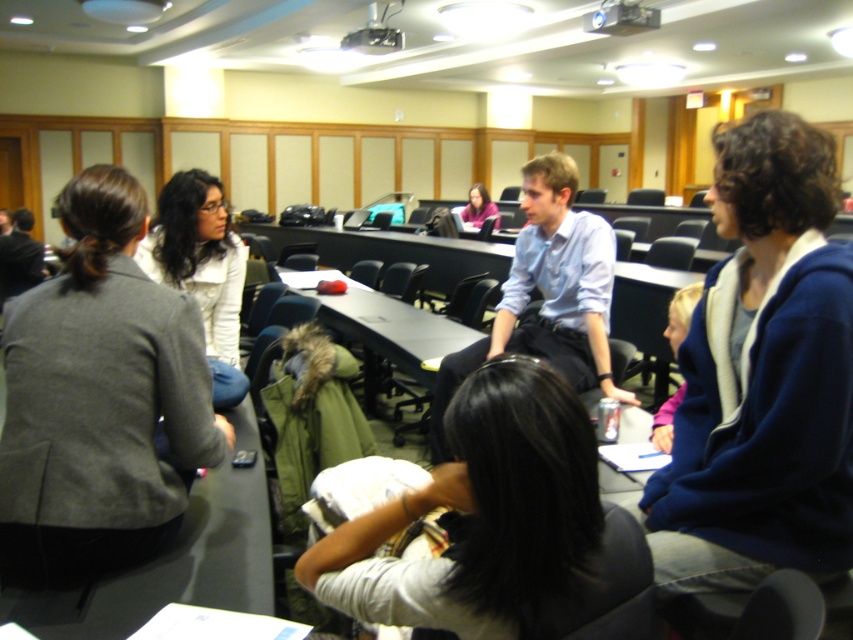
Who is lower down, blue fleece jacket at right or pink fleece sweater at center?

blue fleece jacket at right is below.

What are the coordinates of `blue fleece jacket at right` in the screenshot? It's located at (762, 376).

What do you see at coordinates (386, 330) in the screenshot? The height and width of the screenshot is (640, 853). I see `matte black table at center` at bounding box center [386, 330].

Looking at this image, can you confirm if matte black table at center is shorter than gray wool jacket at left?

Indeed, matte black table at center has a lesser height compared to gray wool jacket at left.

Measure the distance between point (x=469, y=333) and camera.

They are 11.70 feet apart.

Locate an element on the screen. This screenshot has height=640, width=853. matte black table at center is located at coordinates (386, 330).

Is light blue shirt at center further to the viewer compared to gray wool jacket at left?

No, light blue shirt at center is closer to the viewer.

Is point (489, 337) in front of point (12, 234)?

Yes, point (489, 337) is in front of point (12, 234).

What do you see at coordinates (546, 294) in the screenshot? I see `light blue shirt at center` at bounding box center [546, 294].

Where is `light blue shirt at center`? light blue shirt at center is located at coordinates (546, 294).